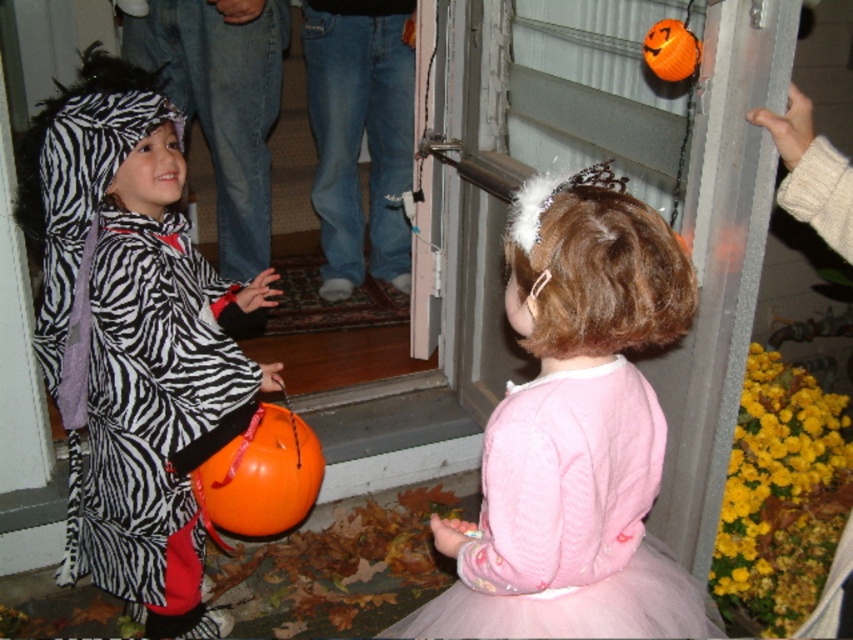
You are a parent trying to take a photo of your children at the Halloween doorway. The zebra print costume at left and the orange matte pumpkin at lower left are both in the frame. Which object will appear bigger in the photo?

The zebra print costume at left will appear bigger in the photo because it is larger in size than the orange matte pumpkin at lower left.

You are a parent trying to arrange Halloween decorations. You have two orange matte pumpkins to place near the door. The scene shows an orange matte pumpkin at lower left and an orange matte pumpkin at upper right. Which pumpkin is more to the left?

The orange matte pumpkin at lower left is positioned on the left side of the orange matte pumpkin at upper right, so it is more to the left.

You are a photographer standing in front of the Halloween scene. You want to take a photo where both the zebra print costume at left and the orange matte pumpkin at lower left are clearly visible. Which object should you focus on first to ensure both are in focus?

You should focus on the zebra print costume at left first because it is closer to the viewer than the orange matte pumpkin at lower left, so adjusting focus from near to far will help both be in focus.